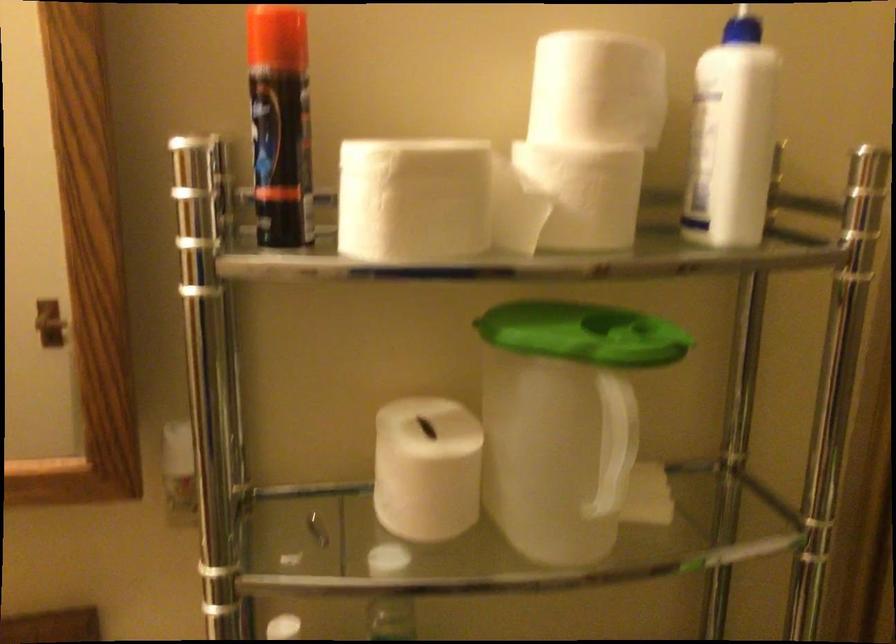
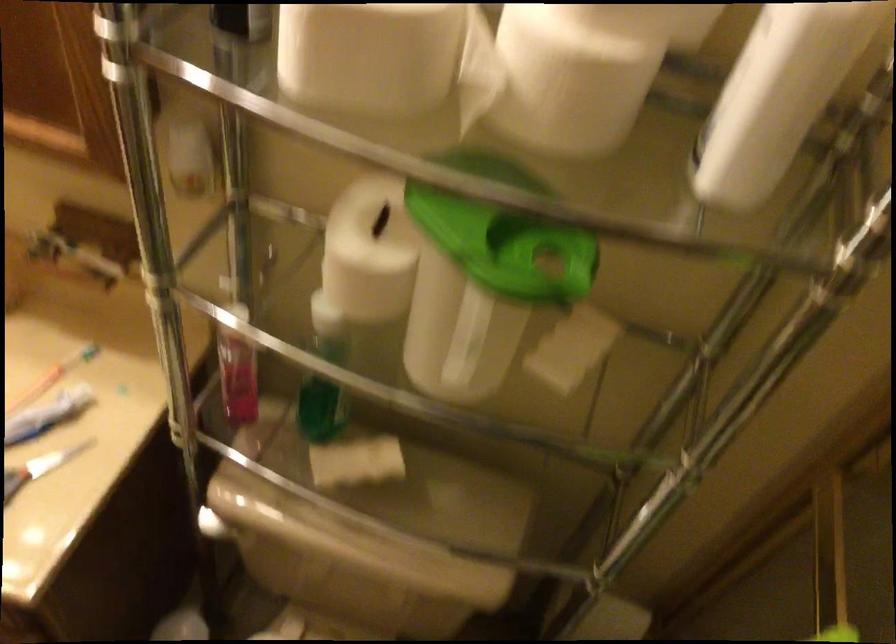
In the second image, find the point that corresponds to [748,152] in the first image.

(778, 96)